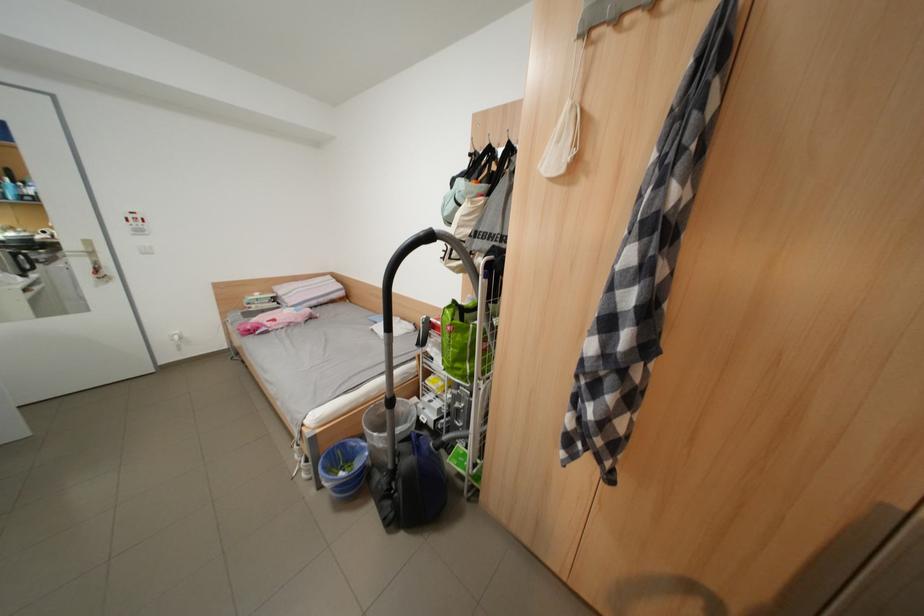
Where would you push the white light switch? Please return your answer as a coordinate pair (x, y).

(150, 230)